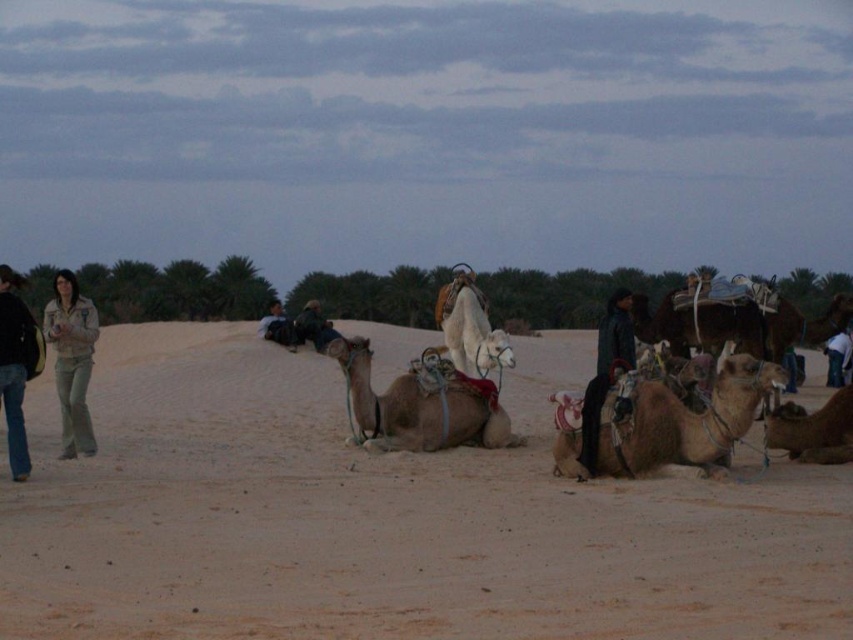
Question: Which of these objects is positioned farthest from the brown textured camel at center?

Choices:
 (A) brown fuzzy camel at right
 (B) white matte camel at center
 (C) dark blue leather jacket at center

Answer: (B)

Question: Which object is farther from the camera taking this photo?

Choices:
 (A) dark green fabric at center
 (B) jeans at left

Answer: (A)

Question: Which object appears closest to the camera in this image?

Choices:
 (A) light brown leather camel at center
 (B) brown textured camel at center
 (C) white matte camel at center

Answer: (B)

Question: Is light brown leather camel at center behind dark blue leather jacket at center?

Choices:
 (A) yes
 (B) no

Answer: (A)

Question: Does jeans at left have a larger size compared to dark green fabric at center?

Choices:
 (A) no
 (B) yes

Answer: (A)

Question: Is jeans at left to the right of dark green fabric at center from the viewer's perspective?

Choices:
 (A) yes
 (B) no

Answer: (A)